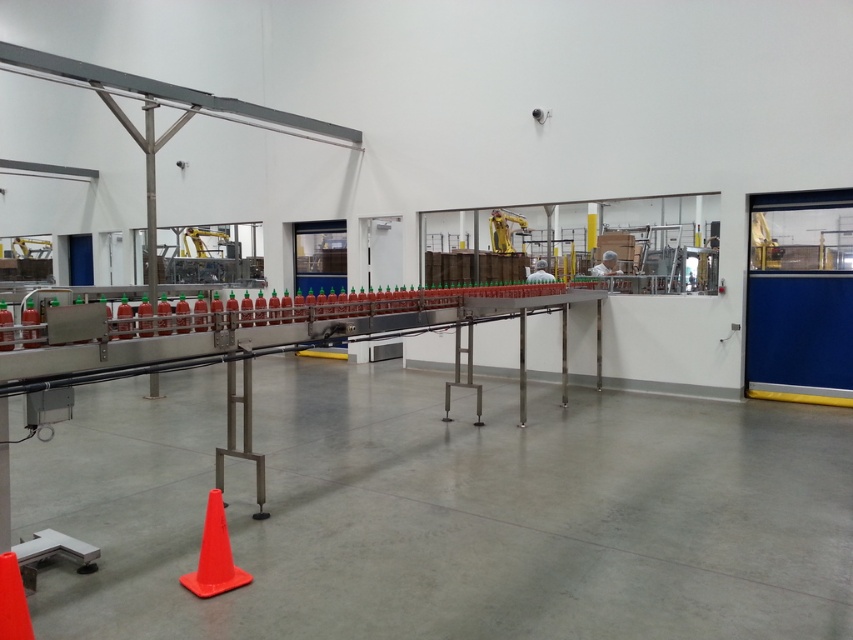
Does orange matte traffic cone at lower left have a lesser width compared to orange matte traffic cone at center?

Incorrect, orange matte traffic cone at lower left's width is not less than orange matte traffic cone at center's.

Is point (224, 582) positioned before point (9, 557)?

That is False.

Does point (224, 540) come farther from viewer compared to point (13, 600)?

Yes.

Image resolution: width=853 pixels, height=640 pixels. In order to click on orange matte traffic cone at lower left in this screenshot , I will do `click(213, 556)`.